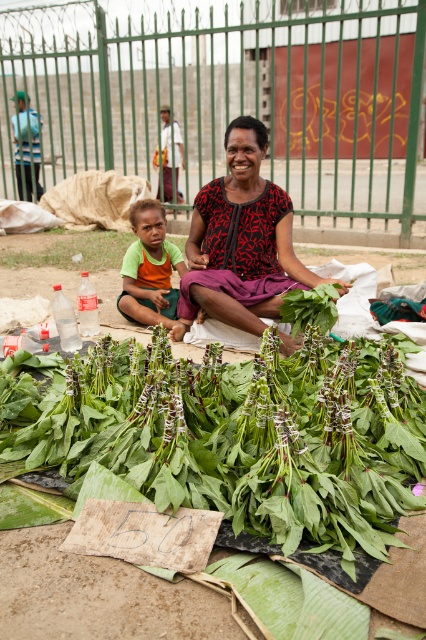
You are a customer at the market and want to buy the green leafy vegetables at center. Where exactly should you look to find them?

The green leafy vegetables at center are located at point coordinates of (241, 435).

You are a customer at the market and see the green leafy vegetables at center and the green fabric shirt at center. Which item is positioned to the right of the other?

The green leafy vegetables at center are to the right of the green fabric shirt at center.